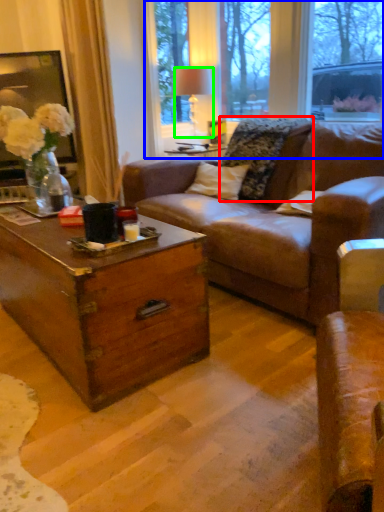
Question: Based on their relative distances, which object is nearer to pillow (highlighted by a red box)? Choose from bay window (highlighted by a blue box) and lamp (highlighted by a green box).

Choices:
 (A) bay window
 (B) lamp

Answer: (B)